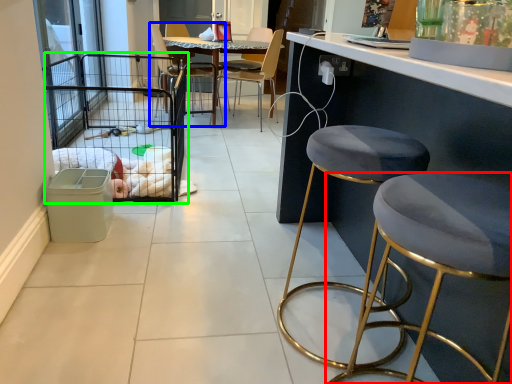
Question: Based on their relative distances, which object is nearer to stool (highlighted by a red box)? Choose from chair (highlighted by a blue box) and cage (highlighted by a green box).

Choices:
 (A) chair
 (B) cage

Answer: (B)